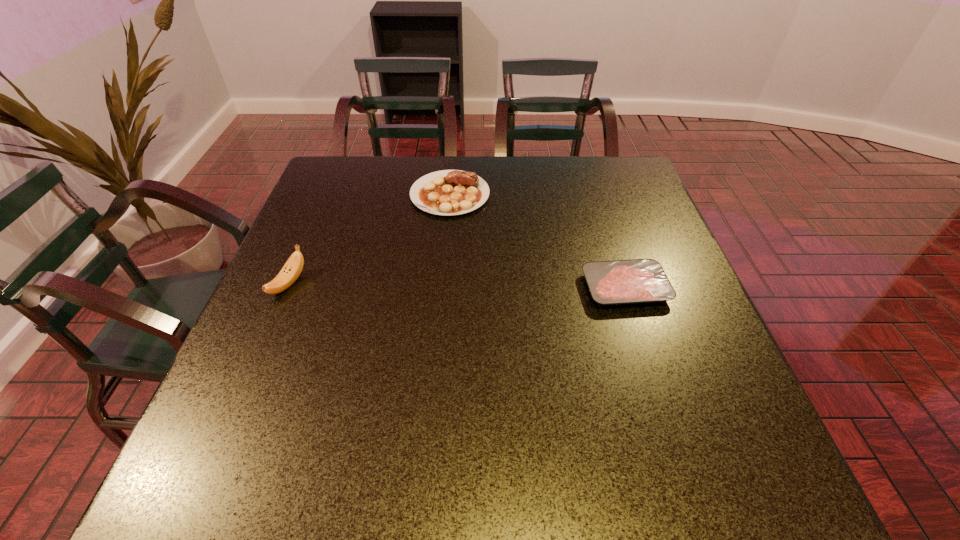
Find the location of a particular element. the tallest object is located at coordinates (290, 272).

At what (x,y) coordinates should I click in order to perform the action: click on banana. Please return your answer as a coordinate pair (x, y). This screenshot has width=960, height=540. Looking at the image, I should click on (290, 272).

Where is `the second tallest object`? the second tallest object is located at coordinates (448, 192).

What are the coordinates of `the farthest object` in the screenshot? It's located at (448, 192).

At what (x,y) coordinates should I click in order to perform the action: click on the rightmost object. Please return your answer as a coordinate pair (x, y). The height and width of the screenshot is (540, 960). Looking at the image, I should click on 615,282.

Find the location of a particular element. The height and width of the screenshot is (540, 960). the nearer steak is located at coordinates (615, 282).

Find the location of a particular element. vacant area situated 0.250m on the right of the tallest object is located at coordinates (411, 284).

Image resolution: width=960 pixels, height=540 pixels. I want to click on free spot located on the front of the taller steak, so [x=443, y=279].

The height and width of the screenshot is (540, 960). Identify the location of vacant space located 0.050m on the back of the shorter steak. (613, 252).

Locate an element on the screen. The width and height of the screenshot is (960, 540). object that is at the far edge is located at coordinates (448, 192).